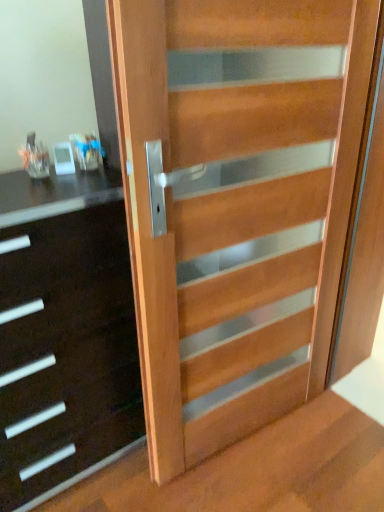
Question: Can you confirm if wooden stairwell at lower right is wider than natural wood door at center?

Choices:
 (A) yes
 (B) no

Answer: (A)

Question: Is the surface of wooden stairwell at lower right in direct contact with natural wood door at center?

Choices:
 (A) yes
 (B) no

Answer: (B)

Question: From a real-world perspective, is wooden stairwell at lower right below natural wood door at center?

Choices:
 (A) yes
 (B) no

Answer: (A)

Question: Does wooden stairwell at lower right have a smaller size compared to natural wood door at center?

Choices:
 (A) no
 (B) yes

Answer: (B)

Question: From a real-world perspective, is wooden stairwell at lower right on top of natural wood door at center?

Choices:
 (A) yes
 (B) no

Answer: (B)

Question: Is wooden stairwell at lower right to the left of natural wood door at center from the viewer's perspective?

Choices:
 (A) yes
 (B) no

Answer: (A)

Question: Does black glossy chest of drawers at left have a lesser height compared to natural wood door at center?

Choices:
 (A) yes
 (B) no

Answer: (A)

Question: From the image's perspective, is black glossy chest of drawers at left on top of natural wood door at center?

Choices:
 (A) yes
 (B) no

Answer: (B)

Question: Is black glossy chest of drawers at left wider than natural wood door at center?

Choices:
 (A) yes
 (B) no

Answer: (A)

Question: Is black glossy chest of drawers at left further to the viewer compared to natural wood door at center?

Choices:
 (A) no
 (B) yes

Answer: (B)

Question: Is black glossy chest of drawers at left positioned before natural wood door at center?

Choices:
 (A) yes
 (B) no

Answer: (B)

Question: Would you say black glossy chest of drawers at left is a long distance from natural wood door at center?

Choices:
 (A) no
 (B) yes

Answer: (A)

Question: Is wooden stairwell at lower right further to camera compared to black glossy chest of drawers at left?

Choices:
 (A) no
 (B) yes

Answer: (A)